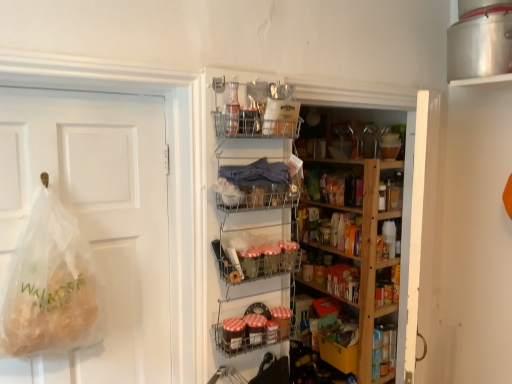
Locate an element on the screen. Image resolution: width=512 pixels, height=384 pixels. metallic wire basket at center, which is counted as the third shelf, starting from the bottom is located at coordinates (257, 249).

How much space does metallic wire baskets at lower center, which is counted as the 5th shelf, starting from the top, occupy horizontally?

metallic wire baskets at lower center, which is counted as the 5th shelf, starting from the top, is 4.47 inches in width.

What is the approximate height of translucent plastic bag at left?

It is 62.09 centimeters.

Image resolution: width=512 pixels, height=384 pixels. Identify the location of wooden shelves at center, the fourth shelf in the top-to-bottom sequence. (336, 240).

Locate an element on the screen. the 4th shelf behind when counting from the clear plastic bag at left is located at coordinates (248, 326).

Is clear plastic bag at left located outside metallic wire baskets at lower center, positioned as the first shelf in bottom-to-top order?

Yes, clear plastic bag at left is outside of metallic wire baskets at lower center, positioned as the first shelf in bottom-to-top order.

Which object is thinner, clear plastic bag at left or metallic wire baskets at lower center, which is counted as the 5th shelf, starting from the top?

clear plastic bag at left is thinner.

Based on the photo, from a real-world perspective, relative to metallic wire baskets at lower center, positioned as the first shelf in bottom-to-top order, is clear plastic bag at left vertically above or below?

clear plastic bag at left is situated higher than metallic wire baskets at lower center, positioned as the first shelf in bottom-to-top order, in the real world.

Is metallic wire basket at center, the third shelf viewed from the top, taller than wooden shelves at center, the fourth shelf in the top-to-bottom sequence?

In fact, metallic wire basket at center, the third shelf viewed from the top, may be shorter than wooden shelves at center, the fourth shelf in the top-to-bottom sequence.

Who is more distant, metallic wire basket at center, which is counted as the third shelf, starting from the bottom, or wooden shelves at center, the second shelf in the bottom-to-top sequence?

wooden shelves at center, the second shelf in the bottom-to-top sequence, is more distant.

The width and height of the screenshot is (512, 384). I want to click on the 1st shelf located beneath the metallic wire basket at center, the third shelf viewed from the top (from a real-world perspective), so click(x=336, y=240).

In terms of width, does metallic wire basket at center, the third shelf viewed from the top, look wider or thinner when compared to wooden shelves at center, the fourth shelf in the top-to-bottom sequence?

Considering their sizes, metallic wire basket at center, the third shelf viewed from the top, looks slimmer than wooden shelves at center, the fourth shelf in the top-to-bottom sequence.

Does translucent plastic bag at left appear on the right side of clear plastic bag at left?

In fact, translucent plastic bag at left is to the left of clear plastic bag at left.

Is translucent plastic bag at left in contact with clear plastic bag at left?

translucent plastic bag at left is not next to clear plastic bag at left, and they're not touching.

Considering the relative sizes of translucent plastic bag at left and clear plastic bag at left in the image provided, is translucent plastic bag at left wider than clear plastic bag at left?

Yes.

Which is closer to the camera, (x=64, y=348) or (x=149, y=340)?

Point (x=64, y=348) is positioned closer to the camera compared to point (x=149, y=340).

Is clear plastic bag at left directly adjacent to translucent plastic bag at left?

No, clear plastic bag at left is not making contact with translucent plastic bag at left.

From the image's perspective, which object appears higher, clear plastic bag at left or translucent plastic bag at left?

From the image's view, clear plastic bag at left is above.

Considering the sizes of clear plastic bag at left and translucent plastic bag at left in the image, is clear plastic bag at left bigger or smaller than translucent plastic bag at left?

Clearly, clear plastic bag at left is larger in size than translucent plastic bag at left.

Which is more to the right, clear plastic bag at left or translucent plastic bag at left?

From the viewer's perspective, clear plastic bag at left appears more on the right side.

Considering the relative sizes of metallic wire basket at center, the third shelf viewed from the top, and metallic wire baskets at lower center, positioned as the first shelf in bottom-to-top order, in the image provided, is metallic wire basket at center, the third shelf viewed from the top, thinner than metallic wire baskets at lower center, positioned as the first shelf in bottom-to-top order,?

Incorrect, the width of metallic wire basket at center, the third shelf viewed from the top, is not less than that of metallic wire baskets at lower center, positioned as the first shelf in bottom-to-top order.

Is metallic wire basket at center, which is counted as the third shelf, starting from the bottom, oriented away from metallic wire baskets at lower center, positioned as the first shelf in bottom-to-top order?

No, metallic wire basket at center, which is counted as the third shelf, starting from the bottom, is not facing away from metallic wire baskets at lower center, positioned as the first shelf in bottom-to-top order.

From a real-world perspective, who is located lower, metallic wire basket at center, which is counted as the third shelf, starting from the bottom, or metallic wire baskets at lower center, which is counted as the 5th shelf, starting from the top?

metallic wire baskets at lower center, which is counted as the 5th shelf, starting from the top, is physically lower.

Between metallic wire basket at center, which is counted as the third shelf, starting from the bottom, and metallic wire baskets at lower center, positioned as the first shelf in bottom-to-top order, which one appears on the right side from the viewer's perspective?

metallic wire basket at center, which is counted as the third shelf, starting from the bottom, is more to the right.

Which of these two, metallic wire basket at upper center, the fifth shelf ordered from the bottom, or metallic wire basket at center, the third shelf viewed from the top, is bigger?

With larger size is metallic wire basket at upper center, the fifth shelf ordered from the bottom.

Which is behind, point (289, 120) or point (242, 230)?

Positioned behind is point (242, 230).

Is metallic wire basket at upper center, the fifth shelf ordered from the bottom, facing towards metallic wire basket at center, which is counted as the third shelf, starting from the bottom?

No, metallic wire basket at upper center, the fifth shelf ordered from the bottom, is not facing towards metallic wire basket at center, which is counted as the third shelf, starting from the bottom.

Which is more distant, [284,165] or [127,209]?

The point [284,165] is behind.

Which is correct: metallic wire basket at center, which is the 2th shelf in top-to-bottom order, is inside clear plastic bag at left, or outside of it?

metallic wire basket at center, which is the 2th shelf in top-to-bottom order, is not inside clear plastic bag at left, it's outside.

From the image's perspective, is metallic wire basket at center, which is the 2th shelf in top-to-bottom order, above clear plastic bag at left?

Yes.

Can you tell me how much metallic wire basket at center, acting as the 4th shelf starting from the bottom, and clear plastic bag at left differ in facing direction?

The angle between the facing direction of metallic wire basket at center, acting as the 4th shelf starting from the bottom, and the facing direction of clear plastic bag at left is 0.000566 degrees.

Locate an element on the screen. door in front of the metallic wire baskets at lower center, which is counted as the 5th shelf, starting from the top is located at coordinates (95, 219).

From a real-world perspective, which shelf is the 1st one above the wooden shelves at center, the second shelf in the bottom-to-top sequence? Please provide its 2D coordinates.

[(257, 249)]

Which object lies nearer to the anchor point translucent plastic bag at left, metallic wire baskets at lower center, positioned as the first shelf in bottom-to-top order, or metallic wire basket at center, which is counted as the third shelf, starting from the bottom?

The object closer to translucent plastic bag at left is metallic wire basket at center, which is counted as the third shelf, starting from the bottom.

Looking at the image, which one is located closer to wooden shelves at center, the second shelf in the bottom-to-top sequence, clear plastic bag at left or metallic wire basket at center, the third shelf viewed from the top?

Among the two, metallic wire basket at center, the third shelf viewed from the top, is located nearer to wooden shelves at center, the second shelf in the bottom-to-top sequence.

When comparing their distances from translucent plastic bag at left, does metallic wire basket at center, which is counted as the third shelf, starting from the bottom, or metallic wire basket at center, acting as the 4th shelf starting from the bottom, seem closer?

→ Among the two, metallic wire basket at center, which is counted as the third shelf, starting from the bottom, is located nearer to translucent plastic bag at left.

In the scene shown: Considering their positions, is wooden shelves at center, the second shelf in the bottom-to-top sequence, positioned closer to translucent plastic bag at left than clear plastic bag at left?

clear plastic bag at left.

Based on their spatial positions, is wooden shelves at center, the fourth shelf in the top-to-bottom sequence, or metallic wire basket at center, the third shelf viewed from the top, closer to metallic wire baskets at lower center, which is counted as the 5th shelf, starting from the top?

The object closer to metallic wire baskets at lower center, which is counted as the 5th shelf, starting from the top, is metallic wire basket at center, the third shelf viewed from the top.

Estimate the real-world distances between objects in this image. Which object is closer to metallic wire basket at center, acting as the 4th shelf starting from the bottom, clear plastic bag at left or metallic wire basket at center, the third shelf viewed from the top?

The object closer to metallic wire basket at center, acting as the 4th shelf starting from the bottom, is metallic wire basket at center, the third shelf viewed from the top.

Estimate the real-world distances between objects in this image. Which object is further from metallic wire baskets at lower center, positioned as the first shelf in bottom-to-top order, metallic wire basket at upper center, the 1th shelf in the top-to-bottom sequence, or metallic wire basket at center, which is counted as the third shelf, starting from the bottom?

metallic wire basket at upper center, the 1th shelf in the top-to-bottom sequence, is positioned further to the anchor metallic wire baskets at lower center, positioned as the first shelf in bottom-to-top order.

In the scene shown: When comparing their distances from metallic wire baskets at lower center, which is counted as the 5th shelf, starting from the top, does translucent plastic bag at left or clear plastic bag at left seem closer?

Among the two, clear plastic bag at left is located nearer to metallic wire baskets at lower center, which is counted as the 5th shelf, starting from the top.

Image resolution: width=512 pixels, height=384 pixels. I want to click on door between metallic wire basket at upper center, the 1th shelf in the top-to-bottom sequence, and metallic wire baskets at lower center, positioned as the first shelf in bottom-to-top order, in the vertical direction, so click(x=95, y=219).

At what (x,y) coordinates should I click in order to perform the action: click on door located between translucent plastic bag at left and metallic wire basket at upper center, the fifth shelf ordered from the bottom, in the left-right direction. Please return your answer as a coordinate pair (x, y). Looking at the image, I should click on click(x=95, y=219).

This screenshot has height=384, width=512. Identify the location of door between translucent plastic bag at left and metallic wire basket at center, the third shelf viewed from the top, from left to right. (95, 219).

What are the coordinates of `door between translucent plastic bag at left and wooden shelves at center, the second shelf in the bottom-to-top sequence` in the screenshot? It's located at (95, 219).